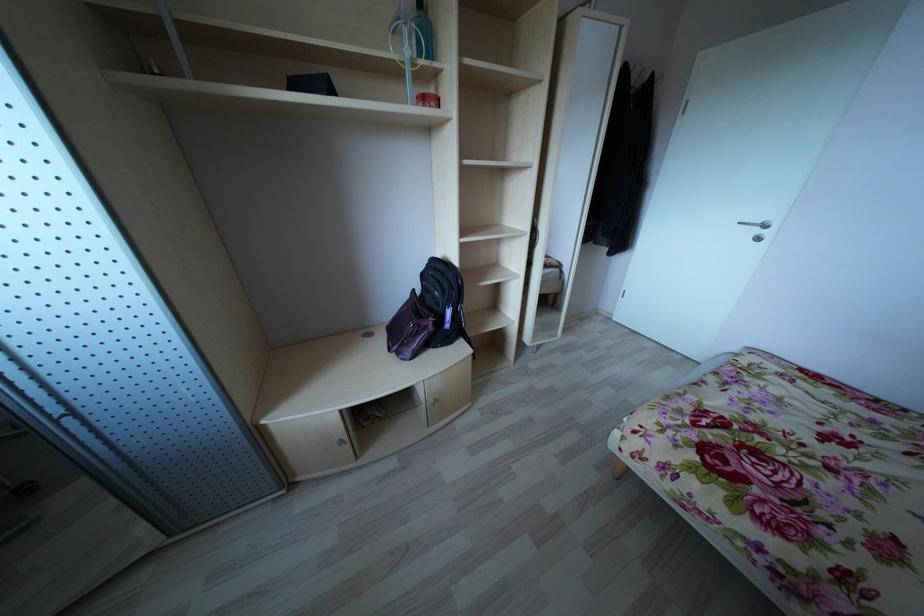
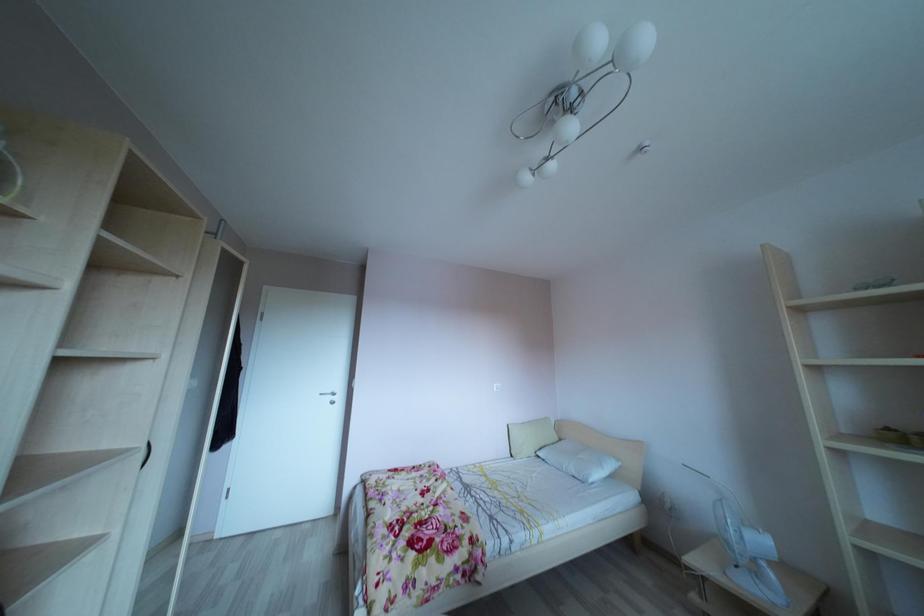
Question: The camera is either moving clockwise (left) or counter-clockwise (right) around the object. The first image is from the beginning of the video and the second image is from the end. Is the camera moving left or right when shooting the video?

Choices:
 (A) Left
 (B) Right

Answer: (A)